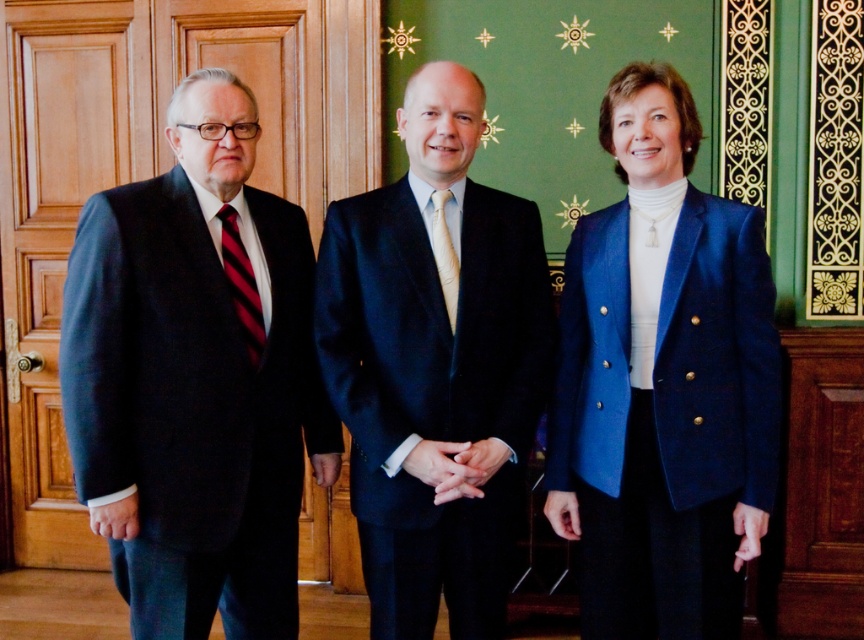
Question: From the image, what is the correct spatial relationship of blue woolen blazer at right in relation to light beige silk tie at center?

Choices:
 (A) above
 (B) below

Answer: (B)

Question: Which object is the closest to the light beige silk tie at center?

Choices:
 (A) matte black suit at left
 (B) striped silk tie at left
 (C) black satin suit at center

Answer: (C)

Question: Which point is farther to the camera?

Choices:
 (A) (442, 284)
 (B) (113, 288)
 (C) (723, 420)
 (D) (399, 433)

Answer: (A)

Question: Does blue woolen blazer at right appear over striped silk tie at left?

Choices:
 (A) no
 (B) yes

Answer: (A)

Question: Which of the following is the closest to the observer?

Choices:
 (A) (548, 289)
 (B) (594, 300)
 (C) (248, 292)

Answer: (C)

Question: Can you confirm if black satin suit at center is wider than striped silk tie at left?

Choices:
 (A) yes
 (B) no

Answer: (A)